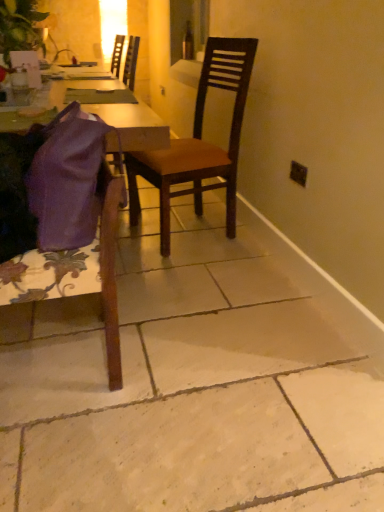
Question: Is purple fabric bag at lower left, the 2th chair from the back, completely or partially outside of purple fabric at left?

Choices:
 (A) no
 (B) yes

Answer: (B)

Question: Considering the relative positions of purple fabric bag at lower left, the 1th chair from the front, and purple fabric at left in the image provided, is purple fabric bag at lower left, the 1th chair from the front, behind purple fabric at left?

Choices:
 (A) no
 (B) yes

Answer: (A)

Question: Is purple fabric bag at lower left, the 2th chair from the back, wider than purple fabric at left?

Choices:
 (A) no
 (B) yes

Answer: (A)

Question: Is purple fabric bag at lower left, the 1th chair from the front, far away from purple fabric at left?

Choices:
 (A) no
 (B) yes

Answer: (A)

Question: From the image's perspective, is purple fabric bag at lower left, the 2th chair from the back, beneath purple fabric at left?

Choices:
 (A) yes
 (B) no

Answer: (A)

Question: From their relative heights in the image, would you say purple fabric at left is taller or shorter than transparent glass bottle at center?

Choices:
 (A) short
 (B) tall

Answer: (B)

Question: Looking at their shapes, would you say purple fabric at left is wider or thinner than transparent glass bottle at center?

Choices:
 (A) thin
 (B) wide

Answer: (B)

Question: Is purple fabric at left bigger or smaller than transparent glass bottle at center?

Choices:
 (A) small
 (B) big

Answer: (B)

Question: Based on their positions, is purple fabric at left located to the left or right of transparent glass bottle at center?

Choices:
 (A) left
 (B) right

Answer: (A)

Question: Do you think black plastic power outlet at upper right is within transparent glass bottle at center, or outside of it?

Choices:
 (A) inside
 (B) outside

Answer: (B)

Question: Based on their positions, is black plastic power outlet at upper right located to the left or right of transparent glass bottle at center?

Choices:
 (A) right
 (B) left

Answer: (A)

Question: Is point (299, 176) positioned closer to the camera than point (190, 53)?

Choices:
 (A) closer
 (B) farther

Answer: (A)

Question: Is black plastic power outlet at upper right in front of or behind transparent glass bottle at center in the image?

Choices:
 (A) front
 (B) behind

Answer: (A)

Question: Choose the correct answer: Is transparent glass bottle at center inside green leafy plant at upper left or outside it?

Choices:
 (A) outside
 (B) inside

Answer: (A)

Question: Is transparent glass bottle at center bigger or smaller than green leafy plant at upper left?

Choices:
 (A) big
 (B) small

Answer: (B)